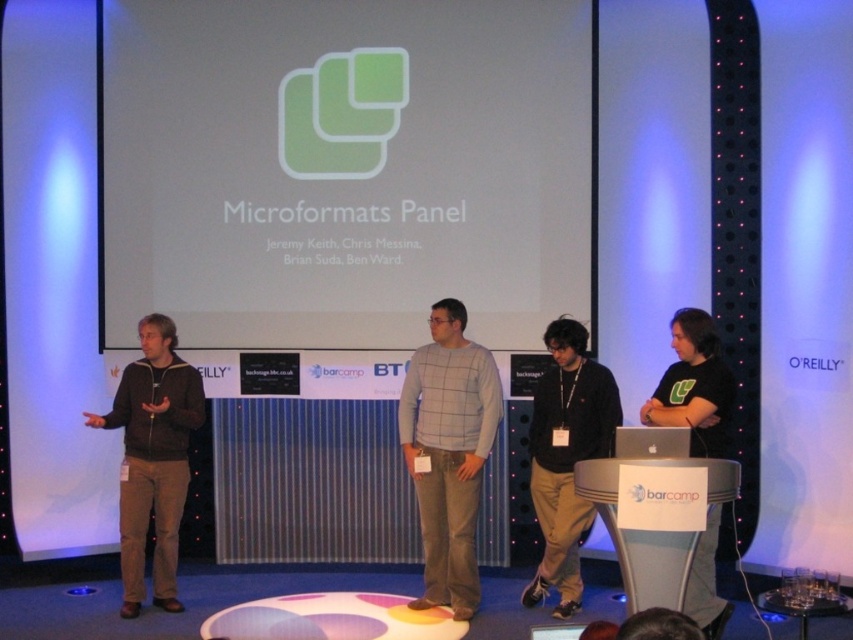
Which is more to the left, black matte shirt at right or silver metallic laptop at center?

From the viewer's perspective, silver metallic laptop at center appears more on the left side.

Does black matte shirt at right have a lesser width compared to silver metallic laptop at center?

No.

Does point (709, 545) lie in front of point (631, 433)?

That is False.

Image resolution: width=853 pixels, height=640 pixels. I want to click on black matte shirt at right, so click(x=694, y=387).

Can you confirm if black matte jacket at center is positioned below silver metallic laptop at center?

Yes, black matte jacket at center is below silver metallic laptop at center.

Is black matte jacket at center further to the viewer compared to silver metallic laptop at center?

Yes, black matte jacket at center is further from the viewer.

You are a GUI agent. You are given a task and a screenshot of the screen. Output one action in this format:
    pyautogui.click(x=<x>, y=<y>)
    Task: Click on the black matte jacket at center
    This screenshot has width=853, height=640.
    Given the screenshot: What is the action you would take?
    pyautogui.click(x=566, y=456)

Does black matte jacket at center have a smaller size compared to black matte shirt at right?

Actually, black matte jacket at center might be larger than black matte shirt at right.

Between black matte jacket at center and black matte shirt at right, which one appears on the left side from the viewer's perspective?

black matte jacket at center is more to the left.

Describe the element at coordinates (566, 456) in the screenshot. I see `black matte jacket at center` at that location.

Image resolution: width=853 pixels, height=640 pixels. In order to click on black matte jacket at center in this screenshot , I will do `click(566, 456)`.